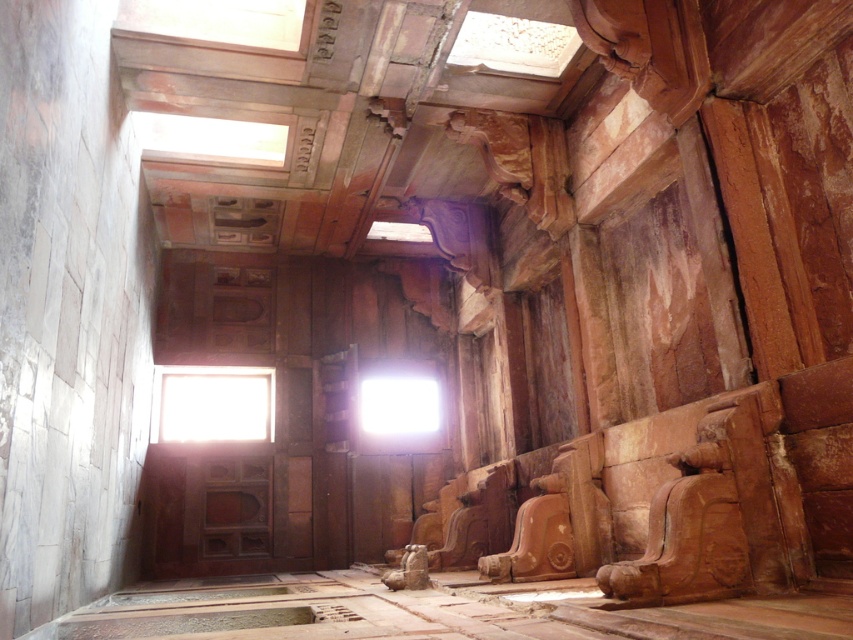
You are an architect examining the interior of an ancient stone structure. You notice two glass elements at the center of the scene. Which one is closer to you, the transparent glass window at center or the bright white glass at center?

The transparent glass window at center is closer to the viewer than the bright white glass at center.

You are an architect analyzing the placement of the transparent glass window at center in the ancient stone structure. Based on the coordinates provided, can you determine if the window is positioned in the upper half or lower half of the image?

The transparent glass window at center is positioned at coordinates point [212,403]. Since the y coordinate is 0.250, which is less than 0.5, it is located in the lower half of the image.

Consider the image. You are standing in the ancient stone structure and want to touch both the point at coordinates (202, 435) and the point at coordinates (373, 412). Which point should you reach for first to touch the closer one?

You should reach for the point at coordinates (202, 435) first because it is closer to you than the point at coordinates (373, 412).